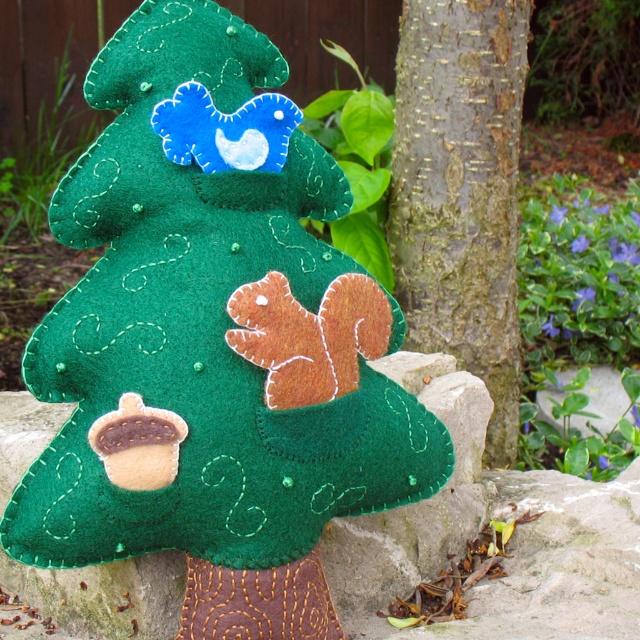
Question: Which point is farther from the camera taking this photo?

Choices:
 (A) (513, 444)
 (B) (260, 563)

Answer: (A)

Question: Does felt squirrel at center lie in front of rough bark tree trunk at center?

Choices:
 (A) yes
 (B) no

Answer: (A)

Question: Can you confirm if felt squirrel at center is positioned above rough bark tree trunk at center?

Choices:
 (A) no
 (B) yes

Answer: (A)

Question: Among these points, which one is nearest to the camera?

Choices:
 (A) (456, 35)
 (B) (342, 636)

Answer: (B)

Question: Considering the relative positions of felt squirrel at center and rough bark tree trunk at center in the image provided, where is felt squirrel at center located with respect to rough bark tree trunk at center?

Choices:
 (A) left
 (B) right

Answer: (A)